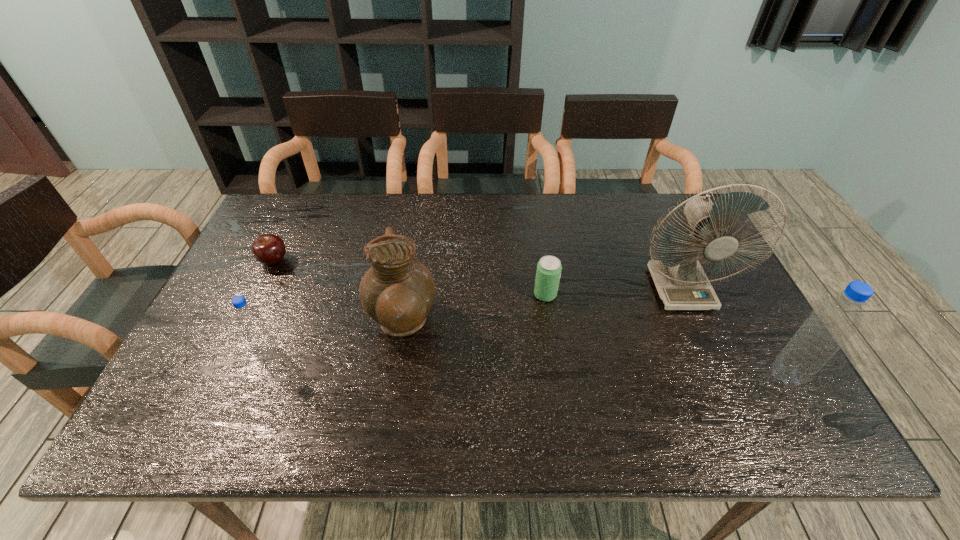
The width and height of the screenshot is (960, 540). Identify the location of vacant space at the far edge of the desktop. (503, 212).

Image resolution: width=960 pixels, height=540 pixels. Identify the location of free space at the near edge of the desktop. (683, 377).

You are a GUI agent. You are given a task and a screenshot of the screen. Output one action in this format:
    pyautogui.click(x=<x>, y=<y>)
    Task: Click on the vacant space at the left edge
    This screenshot has width=960, height=540.
    Given the screenshot: What is the action you would take?
    pyautogui.click(x=283, y=263)

Image resolution: width=960 pixels, height=540 pixels. In the image, there is a desktop. Find the location of `vacant space at the right edge`. vacant space at the right edge is located at coordinates (708, 278).

In order to click on vacant space at the far left corner of the desktop in this screenshot , I will do `click(303, 237)`.

You are a GUI agent. You are given a task and a screenshot of the screen. Output one action in this format:
    pyautogui.click(x=<x>, y=<y>)
    Task: Click on the free region at the near left corner of the desktop
    
    Given the screenshot: What is the action you would take?
    pyautogui.click(x=213, y=373)

This screenshot has height=540, width=960. In the image, there is a desktop. Identify the location of vacant space at the far right corner. (665, 202).

The width and height of the screenshot is (960, 540). Identify the location of free space that is in between the soda and the right water bottle. (666, 335).

The image size is (960, 540). I want to click on unoccupied position between the left water bottle and the apple, so click(272, 308).

You are a GUI agent. You are given a task and a screenshot of the screen. Output one action in this format:
    pyautogui.click(x=<x>, y=<y>)
    Task: Click on the unoccupied area between the right water bottle and the fan
    
    Given the screenshot: What is the action you would take?
    pyautogui.click(x=733, y=333)